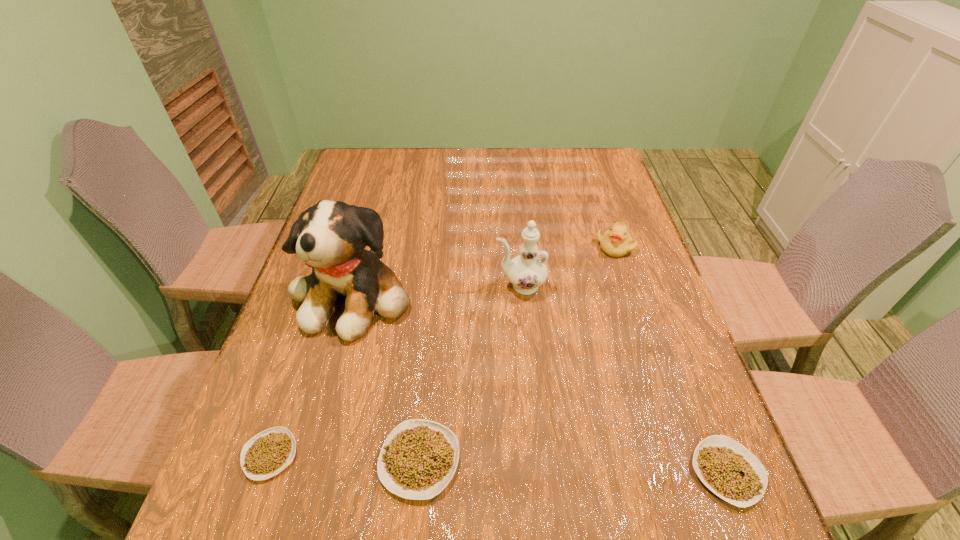
To make them evenly spaced by inserting another legume among them, please locate a free space for this new legume. Please provide its 2D coordinates. Your answer should be formatted as a tuple, i.e. [(x, y)], where the tuple contains the x and y coordinates of a point satisfying the conditions above.

[(572, 466)]